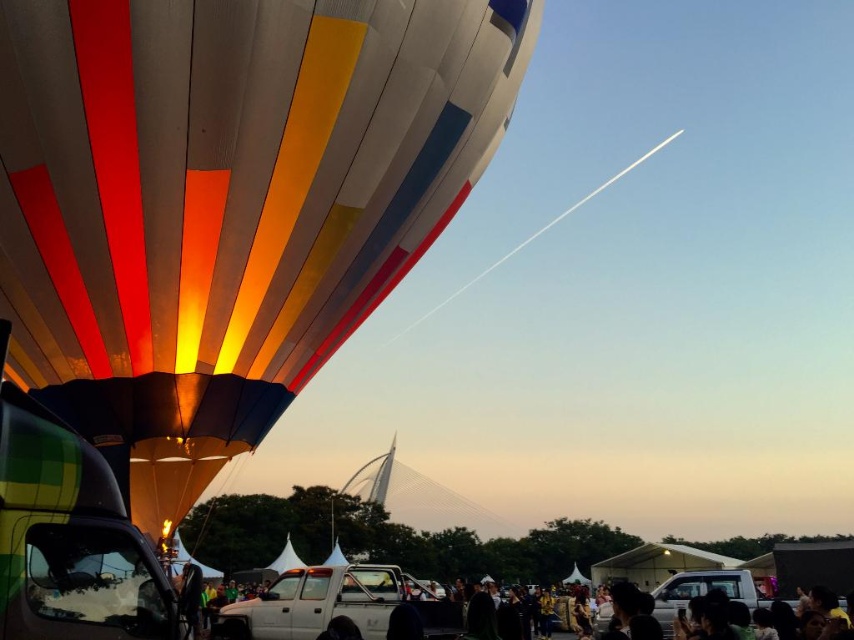
You are a photographer trying to capture the multicolored fabric hot air balloon at upper left and the matte black crowd at lower center in a single shot. Based on their sizes in the image, which object would appear smaller in the final photograph?

The multicolored fabric hot air balloon at upper left would appear smaller in the photograph because it has a smaller size compared to the matte black crowd at lower center.

You are a photographer at the hot air balloon festival. You want to capture a photo of the multicolored fabric hot air balloon at upper left and the matte black crowd at lower center. Based on their positions, will the balloon appear in front of or behind the crowd in the photo?

The multicolored fabric hot air balloon at upper left is positioned over matte black crowd at lower center, so it will appear in front of the crowd in the photo.

You are a photographer standing at the base of the multicolored fabric hot air balloon at upper left. You want to take a photo that includes both the balloon and the matte black crowd at lower center. Based on their distance, will you be able to fit both in the frame without moving your position?

The multicolored fabric hot air balloon at upper left and matte black crowd at lower center are 15.96 feet apart. Since you are positioned at the base of the balloon, this distance suggests that with a standard lens, you might be able to capture both in a single frame without moving, as 15.96 feet is a manageable distance for most camera angles. However, exact framing depends on the camera sensor size and focal length used.